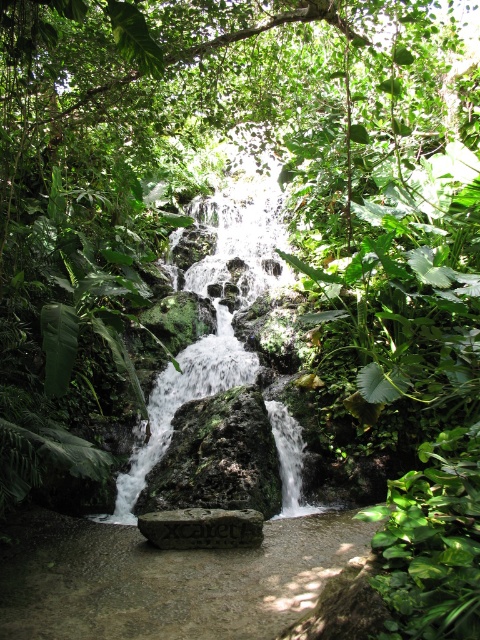
Question: Can you confirm if smooth stone path at center is positioned below gray stone at center?

Choices:
 (A) no
 (B) yes

Answer: (B)

Question: Observing the image, what is the correct spatial positioning of smooth stone path at center in reference to gray stone at center?

Choices:
 (A) above
 (B) below

Answer: (B)

Question: Can you confirm if smooth stone path at center is wider than gray stone at center?

Choices:
 (A) no
 (B) yes

Answer: (B)

Question: Which of the following is the farthest from the observer?

Choices:
 (A) gray stone at center
 (B) smooth stone path at center

Answer: (A)